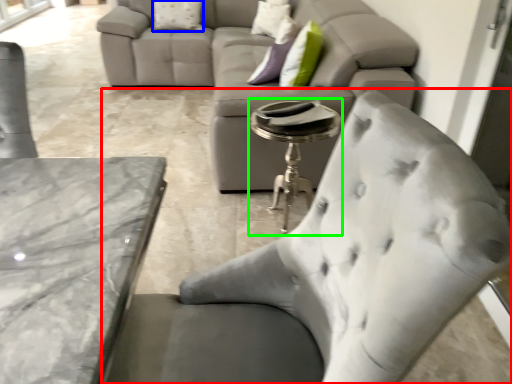
Question: Based on their relative distances, which object is farther from chair (highlighted by a red box)? Choose from pillow (highlighted by a blue box) and side table (highlighted by a green box).

Choices:
 (A) pillow
 (B) side table

Answer: (A)